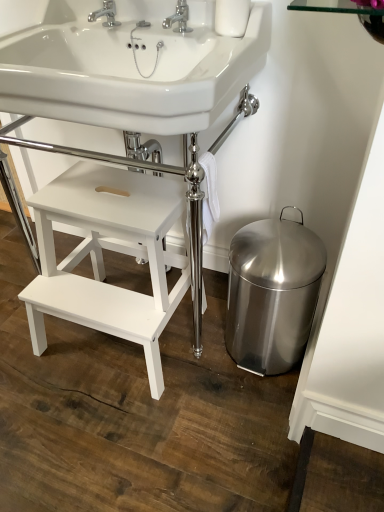
Question: Can you confirm if stainless steel bidet at lower right is positioned to the left of white glossy sink at upper center, the 2th sink positioned from the bottom?

Choices:
 (A) yes
 (B) no

Answer: (B)

Question: Is stainless steel bidet at lower right wider than white glossy sink at upper center, which is counted as the 1th sink, starting from the top?

Choices:
 (A) no
 (B) yes

Answer: (A)

Question: Does stainless steel bidet at lower right have a smaller size compared to white glossy sink at upper center, the 2th sink positioned from the bottom?

Choices:
 (A) yes
 (B) no

Answer: (A)

Question: Is stainless steel bidet at lower right positioned far away from white glossy sink at upper center, the 2th sink positioned from the bottom?

Choices:
 (A) no
 (B) yes

Answer: (A)

Question: Is stainless steel bidet at lower right not inside white glossy sink at upper center, which is counted as the 1th sink, starting from the top?

Choices:
 (A) no
 (B) yes

Answer: (B)

Question: Is stainless steel bidet at lower right positioned before white glossy sink at upper center, which is counted as the 1th sink, starting from the top?

Choices:
 (A) yes
 (B) no

Answer: (B)

Question: Can you confirm if stainless steel bidet at lower right is bigger than chrome metallic faucet at upper center, which is the 1th tap in right-to-left order?

Choices:
 (A) no
 (B) yes

Answer: (B)

Question: From a real-world perspective, is stainless steel bidet at lower right located higher than chrome metallic faucet at upper center, which is the 1th tap in right-to-left order?

Choices:
 (A) yes
 (B) no

Answer: (B)

Question: From the image's perspective, does stainless steel bidet at lower right appear lower than chrome metallic faucet at upper center, acting as the second tap starting from the left?

Choices:
 (A) yes
 (B) no

Answer: (A)

Question: Can you confirm if stainless steel bidet at lower right is smaller than chrome metallic faucet at upper center, which is the 1th tap in right-to-left order?

Choices:
 (A) no
 (B) yes

Answer: (A)

Question: Does stainless steel bidet at lower right have a greater width compared to chrome metallic faucet at upper center, which is the 1th tap in right-to-left order?

Choices:
 (A) yes
 (B) no

Answer: (A)

Question: Can chrome metallic faucet at upper center, which is the 1th tap in right-to-left order, be found inside stainless steel bidet at lower right?

Choices:
 (A) yes
 (B) no

Answer: (B)

Question: Is chrome metallic faucet at upper center, which is the 1th tap in right-to-left order, located outside white glossy sink at upper center, the 2th sink positioned from the bottom?

Choices:
 (A) yes
 (B) no

Answer: (B)